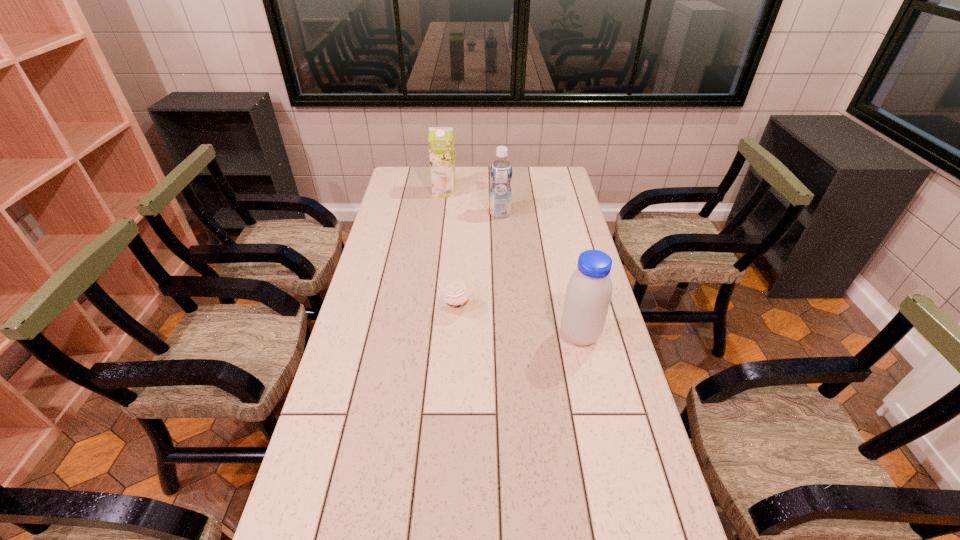
Identify the location of the farthest soya milk. (441, 139).

I want to click on the farthest object, so click(x=441, y=139).

At what (x,y) coordinates should I click in order to perform the action: click on the nearest object. Please return your answer as a coordinate pair (x, y). This screenshot has width=960, height=540. Looking at the image, I should click on (588, 295).

Where is `the rightmost soya milk`? the rightmost soya milk is located at coordinates (588, 295).

Identify the location of the second farthest soya milk. This screenshot has height=540, width=960. (x=500, y=171).

The width and height of the screenshot is (960, 540). In order to click on the second soya milk from left to right in this screenshot , I will do `click(500, 171)`.

The width and height of the screenshot is (960, 540). I want to click on muffin, so click(456, 295).

What are the coordinates of `the shortest object` in the screenshot? It's located at (456, 295).

Locate an element on the screen. vacant region located on the front of the farthest object is located at coordinates (441, 222).

Image resolution: width=960 pixels, height=540 pixels. In order to click on free spot located on the left of the nearest soya milk in this screenshot , I will do `click(473, 335)`.